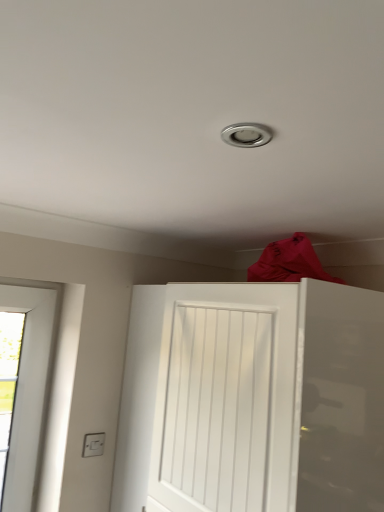
Question: Is white matte door at center taller or shorter than white plastic electric outlet at lower left?

Choices:
 (A) tall
 (B) short

Answer: (A)

Question: From a real-world perspective, relative to white plastic electric outlet at lower left, is white matte door at center vertically above or below?

Choices:
 (A) above
 (B) below

Answer: (A)

Question: Looking at their shapes, would you say white matte door at center is wider or thinner than white plastic electric outlet at lower left?

Choices:
 (A) wide
 (B) thin

Answer: (A)

Question: Is white plastic electric outlet at lower left inside or outside of white matte door at center?

Choices:
 (A) outside
 (B) inside

Answer: (A)

Question: Considering the relative positions of white plastic electric outlet at lower left and white matte door at center in the image provided, is white plastic electric outlet at lower left to the left or to the right of white matte door at center?

Choices:
 (A) right
 (B) left

Answer: (B)

Question: Is white plastic electric outlet at lower left taller or shorter than white matte door at center?

Choices:
 (A) short
 (B) tall

Answer: (A)

Question: From the image's perspective, is white plastic electric outlet at lower left positioned above or below white matte door at center?

Choices:
 (A) below
 (B) above

Answer: (A)